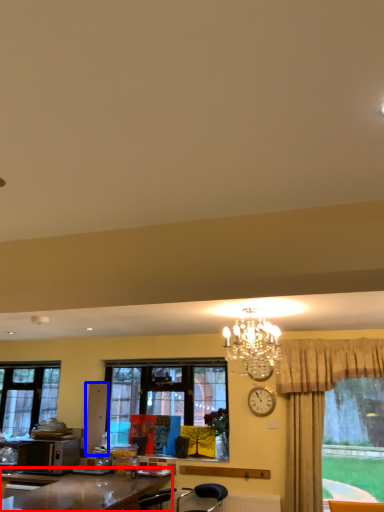
Question: Which of the following is the closest to the observer, desk (highlighted by a red box) or cabinetry (highlighted by a blue box)?

Choices:
 (A) desk
 (B) cabinetry

Answer: (A)